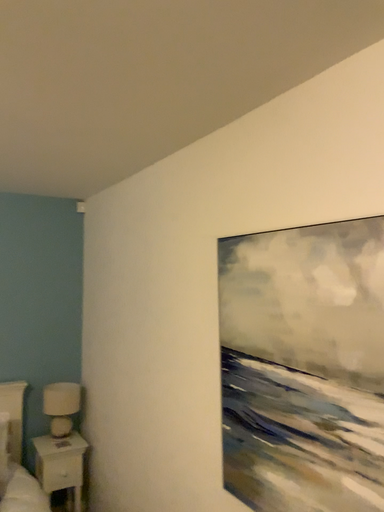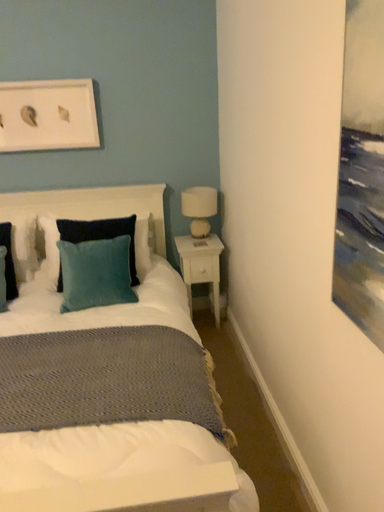
Question: How did the camera likely rotate when shooting the video?

Choices:
 (A) rotated left
 (B) rotated right

Answer: (A)